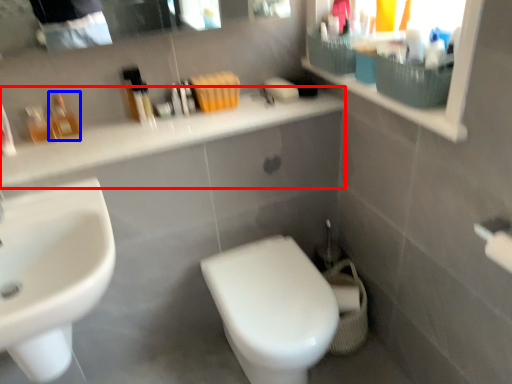
Question: Which object is further to the camera taking this photo, counter top (highlighted by a red box) or toiletry (highlighted by a blue box)?

Choices:
 (A) counter top
 (B) toiletry

Answer: (B)